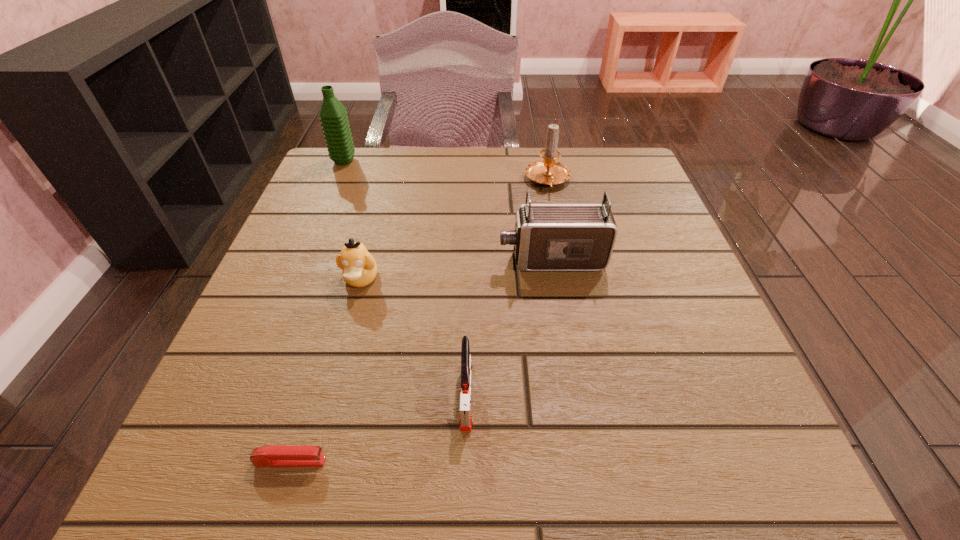
The height and width of the screenshot is (540, 960). Identify the location of vacant space situated 0.390m at the lens of the camcorder. (299, 260).

Find the location of a particular element. This screenshot has width=960, height=540. vacant space situated 0.260m at the lens of the camcorder is located at coordinates (366, 260).

Locate an element on the screen. The width and height of the screenshot is (960, 540). free region located 0.370m at the lens of the camcorder is located at coordinates (309, 260).

At what (x,y) coordinates should I click in order to perform the action: click on vacant space located 0.060m on the back of the candle. Please return your answer as a coordinate pair (x, y). Looking at the image, I should click on (542, 154).

Where is `blank space located on the face of the duckling`? blank space located on the face of the duckling is located at coordinates (316, 446).

Locate an element on the screen. vacant space located on the front-facing side of the nearest object is located at coordinates (575, 461).

Where is `water bottle that is positioned at the far edge`? water bottle that is positioned at the far edge is located at coordinates (333, 116).

Image resolution: width=960 pixels, height=540 pixels. Find the location of `candle situated at the far edge`. candle situated at the far edge is located at coordinates (547, 171).

I want to click on water bottle that is at the left edge, so click(333, 116).

Locate an element on the screen. duckling positioned at the left edge is located at coordinates (359, 268).